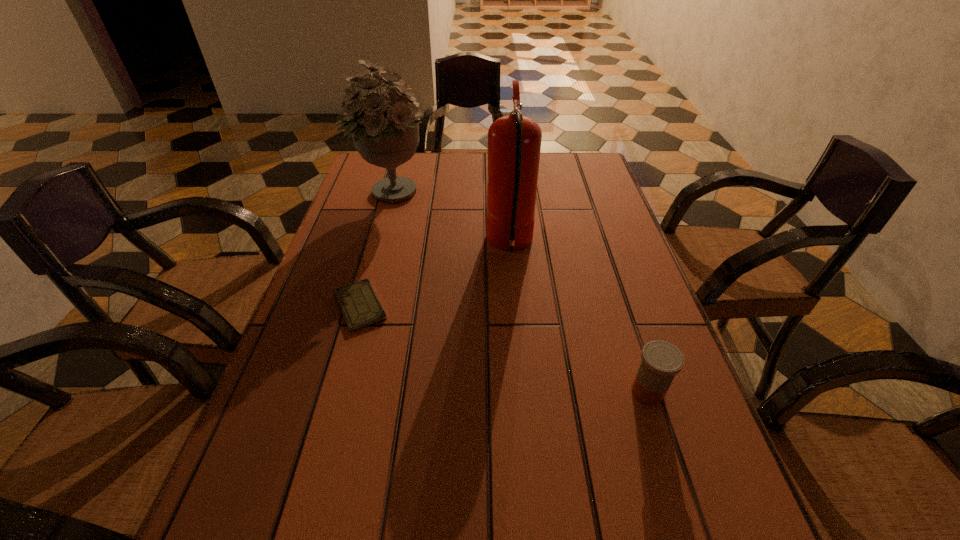
You are a GUI agent. You are given a task and a screenshot of the screen. Output one action in this format:
    pyautogui.click(x=<x>, y=<y>)
    Task: Click on the fire extinguisher
    The width and height of the screenshot is (960, 540).
    Given the screenshot: What is the action you would take?
    pyautogui.click(x=514, y=141)

This screenshot has height=540, width=960. I want to click on the third nearest object, so click(514, 141).

The height and width of the screenshot is (540, 960). I want to click on bouquet, so click(x=386, y=134).

I want to click on the rightmost object, so click(661, 361).

Locate an element on the screen. the nearest object is located at coordinates (661, 361).

Where is `checkbook`? This screenshot has width=960, height=540. checkbook is located at coordinates (360, 306).

Find the location of a particular element. This screenshot has width=960, height=540. the third farthest object is located at coordinates pos(360,306).

The width and height of the screenshot is (960, 540). Identify the location of free location located towards the nozzle of the fire extinguisher. (409, 245).

Locate an element on the screen. This screenshot has width=960, height=540. vacant position located 0.170m towards the nozzle of the fire extinguisher is located at coordinates (420, 245).

Where is `vacant space situated 0.170m towards the nozzle of the fire extinguisher`? vacant space situated 0.170m towards the nozzle of the fire extinguisher is located at coordinates click(420, 245).